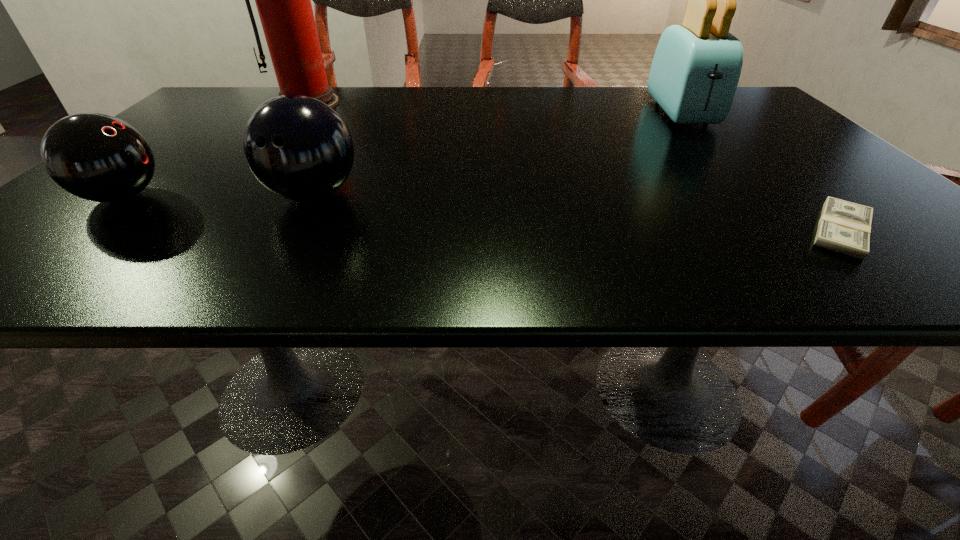
Where is `fire extinguisher`? The width and height of the screenshot is (960, 540). fire extinguisher is located at coordinates (283, 0).

The width and height of the screenshot is (960, 540). In order to click on toaster in this screenshot , I will do `click(696, 68)`.

This screenshot has width=960, height=540. I want to click on the right bowling ball, so click(299, 148).

Identify the location of the second shortest object. The image size is (960, 540). (97, 157).

Find the location of a particular element. the leftmost object is located at coordinates click(97, 157).

This screenshot has width=960, height=540. In order to click on dollar in this screenshot , I will do `click(844, 227)`.

Find the location of a particular element. free region located at the discharge end of the tallest object is located at coordinates (231, 197).

In order to click on free location located on the side of the toaster with the lever in this screenshot , I will do `click(784, 224)`.

At what (x,y) coordinates should I click in order to perform the action: click on vacant space situated 0.080m on the side of the right bowling ball with the finger holes. Please return your answer as a coordinate pair (x, y). This screenshot has height=540, width=960. Looking at the image, I should click on (282, 250).

This screenshot has width=960, height=540. Find the location of `vacant point located 0.280m on the surface of the second shortest object near the finger holes`. vacant point located 0.280m on the surface of the second shortest object near the finger holes is located at coordinates (317, 197).